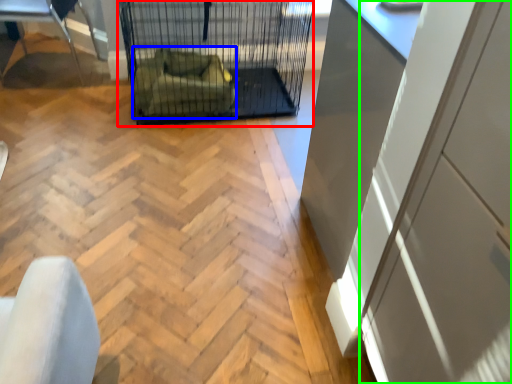
Question: Which object is the closest to the bird cage (highlighted by a red box)? Choose among these: armchair (highlighted by a blue box) or screen door (highlighted by a green box).

Choices:
 (A) armchair
 (B) screen door

Answer: (A)